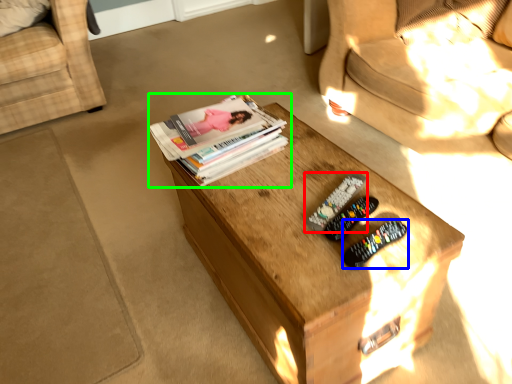
Question: Based on their relative distances, which object is farther from remote control (highlighted by a red box)? Choose from remote control (highlighted by a blue box) and book (highlighted by a green box).

Choices:
 (A) remote control
 (B) book

Answer: (B)